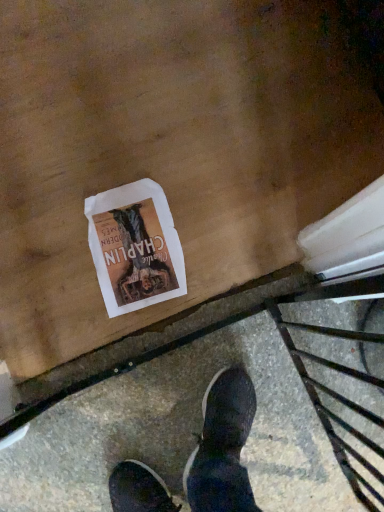
The width and height of the screenshot is (384, 512). What do you see at coordinates (135, 247) in the screenshot?
I see `white paper flyer at center` at bounding box center [135, 247].

Measure the distance between point [128,226] and camera.

A distance of 1.01 meters exists between point [128,226] and camera.

The image size is (384, 512). Identify the location of white paper flyer at center. (135, 247).

The height and width of the screenshot is (512, 384). What do you see at coordinates (201, 421) in the screenshot?
I see `concrete pavement at lower center` at bounding box center [201, 421].

At what (x,y) coordinates should I click in order to perform the action: click on concrete pavement at lower center. Please return your answer as a coordinate pair (x, y). Image resolution: width=384 pixels, height=512 pixels. Looking at the image, I should click on (201, 421).

Measure the distance between concrete pavement at lower center and camera.

The distance of concrete pavement at lower center from camera is 35.06 inches.

I want to click on white paper flyer at center, so click(135, 247).

Would you say concrete pavement at lower center is to the left or to the right of white paper flyer at center in the picture?

From the image, it's evident that concrete pavement at lower center is to the right of white paper flyer at center.

Is the depth of concrete pavement at lower center less than that of white paper flyer at center?

Yes, it is in front of white paper flyer at center.

Is point (354, 353) closer to viewer compared to point (123, 224)?

Yes.

From the image's perspective, is concrete pavement at lower center over white paper flyer at center?

No.

From a real-world perspective, is concrete pavement at lower center beneath white paper flyer at center?

Incorrect, from a real-world perspective, concrete pavement at lower center is higher than white paper flyer at center.

From the picture: Considering the relative sizes of concrete pavement at lower center and white paper flyer at center in the image provided, is concrete pavement at lower center thinner than white paper flyer at center?

Yes.

In terms of height, does concrete pavement at lower center look taller or shorter compared to white paper flyer at center?

concrete pavement at lower center is taller than white paper flyer at center.

Who is bigger, concrete pavement at lower center or white paper flyer at center?

Bigger between the two is concrete pavement at lower center.

Would you say white paper flyer at center is part of concrete pavement at lower center's contents?

No, white paper flyer at center is not a part of concrete pavement at lower center.

Is there a large distance between concrete pavement at lower center and white paper flyer at center?

concrete pavement at lower center is actually quite close to white paper flyer at center.

Could you tell me if concrete pavement at lower center is turned towards white paper flyer at center?

No, concrete pavement at lower center is not turned towards white paper flyer at center.

How much distance is there between concrete pavement at lower center and white paper flyer at center?

They are 12.27 inches apart.

Where is `flyer lying above the concrete pavement at lower center (from the image's perspective)`? This screenshot has width=384, height=512. flyer lying above the concrete pavement at lower center (from the image's perspective) is located at coordinates (135, 247).

Based on their positions, is white paper flyer at center located to the left or right of concrete pavement at lower center?

From the image, it's evident that white paper flyer at center is to the left of concrete pavement at lower center.

Which object is closer to the camera, white paper flyer at center or concrete pavement at lower center?

concrete pavement at lower center.

Between point (182, 281) and point (131, 439), which one is positioned in front?

The point (131, 439) is closer.

From the image's perspective, which one is positioned higher, white paper flyer at center or concrete pavement at lower center?

white paper flyer at center.

From a real-world perspective, is white paper flyer at center on concrete pavement at lower center?

No, from a real-world perspective, white paper flyer at center is not above concrete pavement at lower center.

Can you confirm if white paper flyer at center is thinner than concrete pavement at lower center?

In fact, white paper flyer at center might be wider than concrete pavement at lower center.

Considering the relative sizes of white paper flyer at center and concrete pavement at lower center in the image provided, is white paper flyer at center taller than concrete pavement at lower center?

No, white paper flyer at center is not taller than concrete pavement at lower center.

Based on their sizes in the image, would you say white paper flyer at center is bigger or smaller than concrete pavement at lower center?

white paper flyer at center is smaller than concrete pavement at lower center.

Would you say white paper flyer at center contains concrete pavement at lower center?

No.

Can you see white paper flyer at center touching concrete pavement at lower center?

No.

Could you tell me if white paper flyer at center is turned towards concrete pavement at lower center?

No, white paper flyer at center does not turn towards concrete pavement at lower center.

Image resolution: width=384 pixels, height=512 pixels. In order to click on flyer above the concrete pavement at lower center (from the image's perspective) in this screenshot , I will do `click(135, 247)`.

Identify the location of flyer that appears on the left of concrete pavement at lower center. (135, 247).

Locate an element on the screen. The width and height of the screenshot is (384, 512). pavement above the white paper flyer at center (from a real-world perspective) is located at coordinates (201, 421).